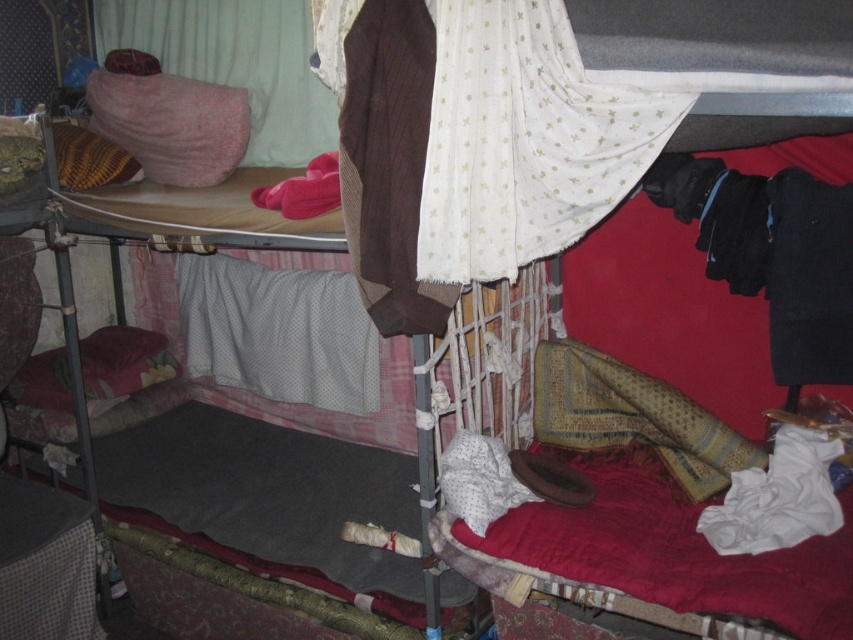
Looking at this image, you are trying to reach the pink soft pillow at upper left to retrieve a hidden note. There is a velvety pink pillow at upper left blocking your view. Which pillow should you move to access the note?

You should move the velvety pink pillow at upper left because the pink soft pillow at upper left is behind it, so moving the front one will allow access to the one behind.

You are trying to decide which pillow to use for your head. Both the velvety pink pillow at upper left and the pink soft pillow at upper left are available. Which one is bigger?

The velvety pink pillow at upper left is larger in size compared to the pink soft pillow at upper left, so you should choose the velvety pink pillow at upper left if you want a bigger one.

You are a photographer standing at the foot of the lower bunk bed. You want to take a photo of the velvety pink pillow at upper left. Considering your current position, can you physically reach the pillow to adjust its position before taking the photo?

The distance between the velvety pink pillow at upper left and the camera is 2.76 meters. Since you are standing at the foot of the lower bunk bed, the pillow is too far away for you to physically reach it without moving closer or using a tool.